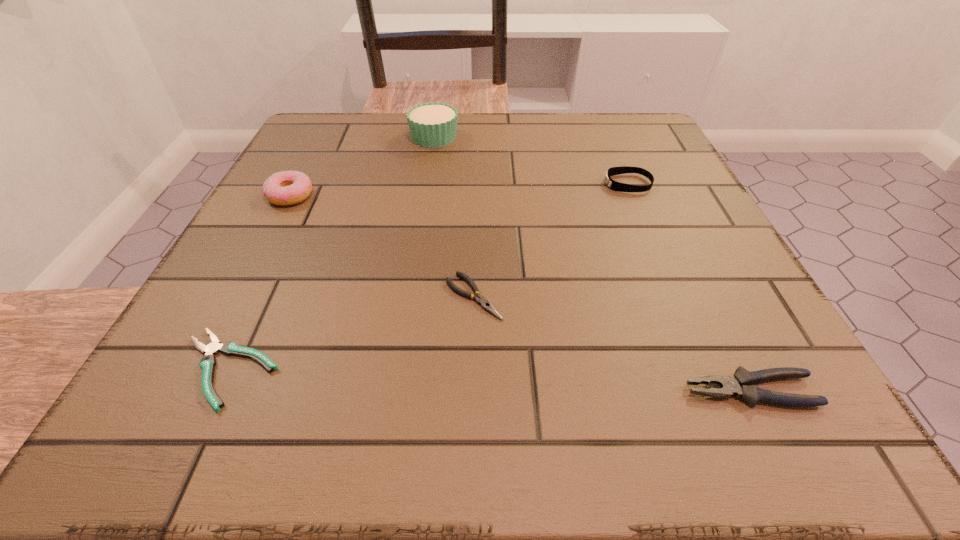
At what (x,y) coordinates should I click in order to perform the action: click on free space between the tallest object and the leftmost pliers. Please return your answer as a coordinate pair (x, y). This screenshot has width=960, height=540. Looking at the image, I should click on (331, 253).

You are a GUI agent. You are given a task and a screenshot of the screen. Output one action in this format:
    pyautogui.click(x=<x>, y=<y>)
    Task: Click on the empty space that is in between the fifth tallest object and the wristband
    
    Given the screenshot: What is the action you would take?
    pyautogui.click(x=551, y=240)

The width and height of the screenshot is (960, 540). I want to click on object that is the third closest to the shortest object, so click(434, 124).

Image resolution: width=960 pixels, height=540 pixels. Identify the location of object that stands as the closest to the rightmost pliers. pyautogui.click(x=480, y=300).

The width and height of the screenshot is (960, 540). I want to click on pliers that stands as the closest to the farthest pliers, so click(x=208, y=362).

Point out which pliers is positioned as the second nearest to the wristband. Please provide its 2D coordinates. Your answer should be formatted as a tuple, i.e. [(x, y)], where the tuple contains the x and y coordinates of a point satisfying the conditions above.

[(739, 384)]

You are a GUI agent. You are given a task and a screenshot of the screen. Output one action in this format:
    pyautogui.click(x=<x>, y=<y>)
    Task: Click on the blank space that satisfies the following two spatial constraints: 1. on the back side of the doughnut; 2. on the left side of the cupcake
    Image resolution: width=960 pixels, height=540 pixels.
    Given the screenshot: What is the action you would take?
    pyautogui.click(x=321, y=137)

Where is `free location that satisfies the following two spatial constraints: 1. on the back side of the third nearest object; 2. on the left side of the shortest pliers`? This screenshot has width=960, height=540. free location that satisfies the following two spatial constraints: 1. on the back side of the third nearest object; 2. on the left side of the shortest pliers is located at coordinates (262, 296).